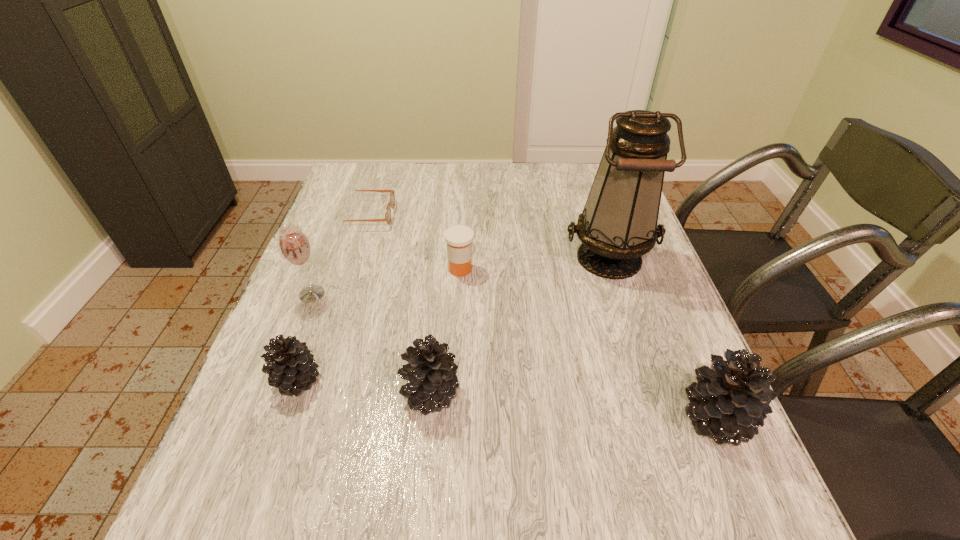
Image resolution: width=960 pixels, height=540 pixels. In order to click on pinecone that is at the right edge in this screenshot , I will do `click(729, 402)`.

The image size is (960, 540). I want to click on oil lamp located in the right edge section of the desktop, so click(x=618, y=225).

I want to click on object present at the far left corner, so click(392, 198).

Find the location of a particular element. object located at the near right corner is located at coordinates (729, 402).

This screenshot has height=540, width=960. I want to click on free space at the far edge of the desktop, so click(x=540, y=183).

The image size is (960, 540). What are the coordinates of `vacant space at the near edge of the desktop` in the screenshot? It's located at (431, 423).

This screenshot has height=540, width=960. What are the coordinates of `free space at the left edge of the desktop` in the screenshot? It's located at (341, 207).

I want to click on free space at the right edge of the desktop, so click(628, 320).

Locate an element on the screen. The height and width of the screenshot is (540, 960). vacant space at the far left corner of the desktop is located at coordinates (387, 174).

Identify the location of vacant space at the far right corner. The height and width of the screenshot is (540, 960). (577, 186).